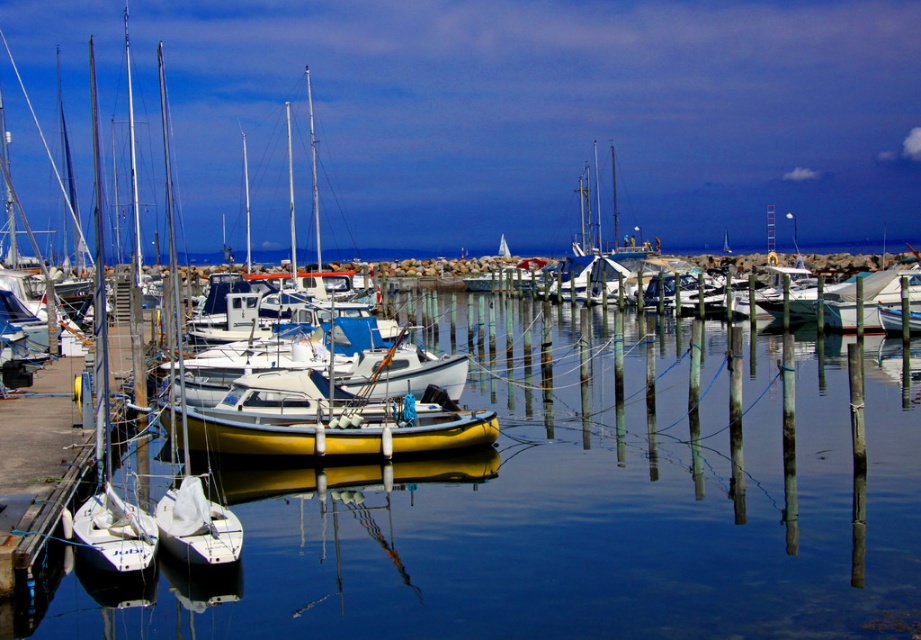
Question: Estimate the real-world distances between objects in this image. Which object is closer to the transparent water at center?

Choices:
 (A) white matte sailboat at center
 (B) yellow matte boat at center
 (C) yellow matte sailboat at center

Answer: (B)

Question: Can you confirm if transparent water at center is positioned to the right of yellow matte sailboat at center?

Choices:
 (A) no
 (B) yes

Answer: (B)

Question: Does yellow matte boat at center appear on the left side of white matte sailboat at center?

Choices:
 (A) yes
 (B) no

Answer: (A)

Question: Which of these objects is positioned closest to the transparent water at center?

Choices:
 (A) yellow matte boat at center
 (B) yellow matte sailboat at center

Answer: (A)

Question: Which of these objects is positioned closest to the white matte sailboat at center?

Choices:
 (A) yellow matte sailboat at center
 (B) transparent water at center
 (C) yellow matte boat at center

Answer: (B)

Question: Does yellow matte boat at center appear on the right side of yellow matte sailboat at center?

Choices:
 (A) no
 (B) yes

Answer: (B)